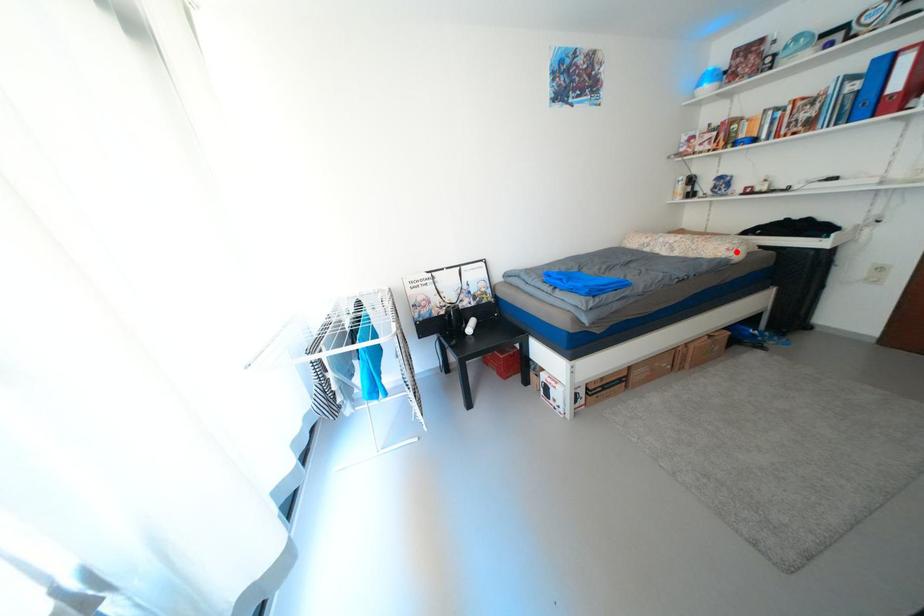
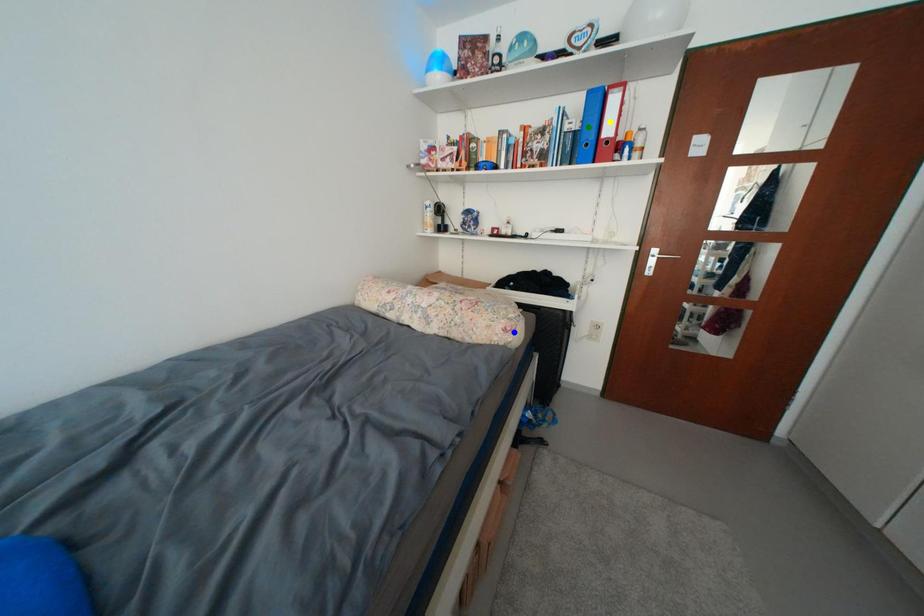
Question: I am providing you with two images of the same scene from different viewpoints. A red point is marked on the first image. You are given multiple points on the second image. Which spot in image 2 lines up with the point in image 1?

Choices:
 (A) blue point
 (B) yellow point
 (C) green point

Answer: (A)